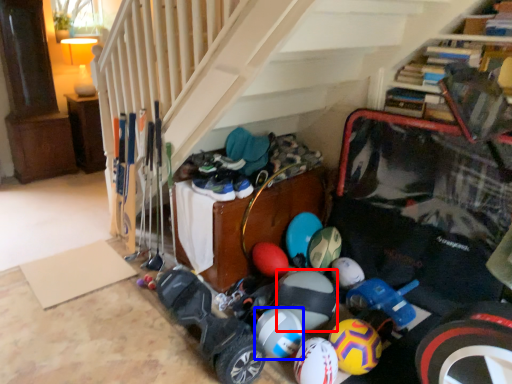
Question: Among these objects, which one is farthest to the camera, beach ball (highlighted by a red box) or bowling ball (highlighted by a blue box)?

Choices:
 (A) beach ball
 (B) bowling ball

Answer: (A)